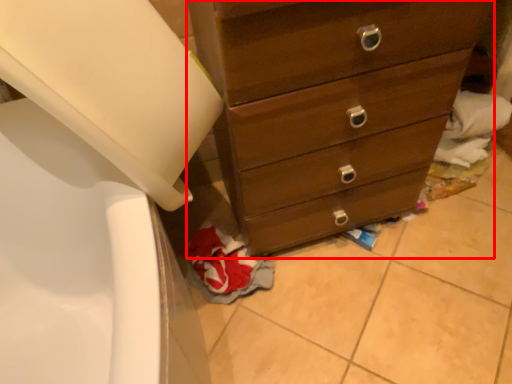
Question: From the image's perspective, where is chest of drawers (annotated by the red box) located in relation to material in the image?

Choices:
 (A) below
 (B) above

Answer: (B)